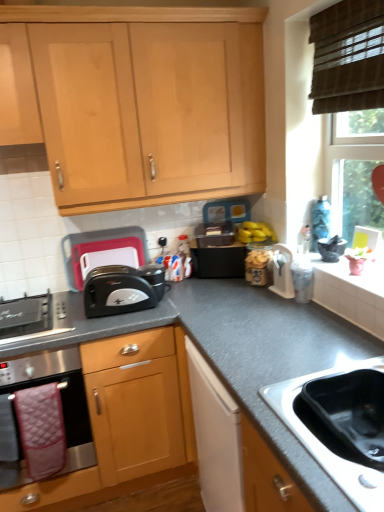
Question: Is black plastic toaster at center-left, which ranks as the 1th appliance in left-to-right order, in contact with stainless steel sink at lower right?

Choices:
 (A) no
 (B) yes

Answer: (A)

Question: Is stainless steel sink at lower right at the back of black plastic toaster at center-left, the second appliance in the right-to-left sequence?

Choices:
 (A) no
 (B) yes

Answer: (A)

Question: From the image's perspective, does black plastic toaster at center-left, which ranks as the 1th appliance in left-to-right order, appear lower than stainless steel sink at lower right?

Choices:
 (A) yes
 (B) no

Answer: (B)

Question: Is black plastic toaster at center-left, which appears as the 1th appliance when viewed from the back, aimed at stainless steel sink at lower right?

Choices:
 (A) yes
 (B) no

Answer: (A)

Question: From a real-world perspective, is black plastic toaster at center-left, which appears as the 1th appliance when viewed from the back, under stainless steel sink at lower right?

Choices:
 (A) no
 (B) yes

Answer: (A)

Question: In terms of height, does black plastic toaster at center-left, acting as the second appliance starting from the front, look taller or shorter compared to light wood cabinet at upper center, arranged as the 1th cabinetry when viewed from the top?

Choices:
 (A) tall
 (B) short

Answer: (B)

Question: Is point (125, 227) positioned closer to the camera than point (162, 94)?

Choices:
 (A) farther
 (B) closer

Answer: (A)

Question: From a real-world perspective, relative to light wood cabinet at upper center, marked as the second cabinetry in a bottom-to-top arrangement, is black plastic toaster at center-left, acting as the second appliance starting from the front, vertically above or below?

Choices:
 (A) above
 (B) below

Answer: (B)

Question: Is black plastic toaster at center-left, the second appliance in the right-to-left sequence, to the left or to the right of light wood cabinet at upper center, arranged as the 1th cabinetry when viewed from the top, in the image?

Choices:
 (A) right
 (B) left

Answer: (B)

Question: Is gray granite countertop at center wider or thinner than black plastic toaster at center?

Choices:
 (A) thin
 (B) wide

Answer: (B)

Question: From a real-world perspective, relative to black plastic toaster at center, is gray granite countertop at center vertically above or below?

Choices:
 (A) below
 (B) above

Answer: (A)

Question: In terms of size, does gray granite countertop at center appear bigger or smaller than black plastic toaster at center?

Choices:
 (A) big
 (B) small

Answer: (A)

Question: From their relative heights in the image, would you say gray granite countertop at center is taller or shorter than black plastic toaster at center?

Choices:
 (A) short
 (B) tall

Answer: (B)

Question: Would you say black plastic toaster at center-left, the second appliance in the right-to-left sequence, is to the left or to the right of stainless steel oven at lower left in the picture?

Choices:
 (A) left
 (B) right

Answer: (B)

Question: From the image's perspective, relative to stainless steel oven at lower left, is black plastic toaster at center-left, the second appliance in the right-to-left sequence, above or below?

Choices:
 (A) below
 (B) above

Answer: (B)